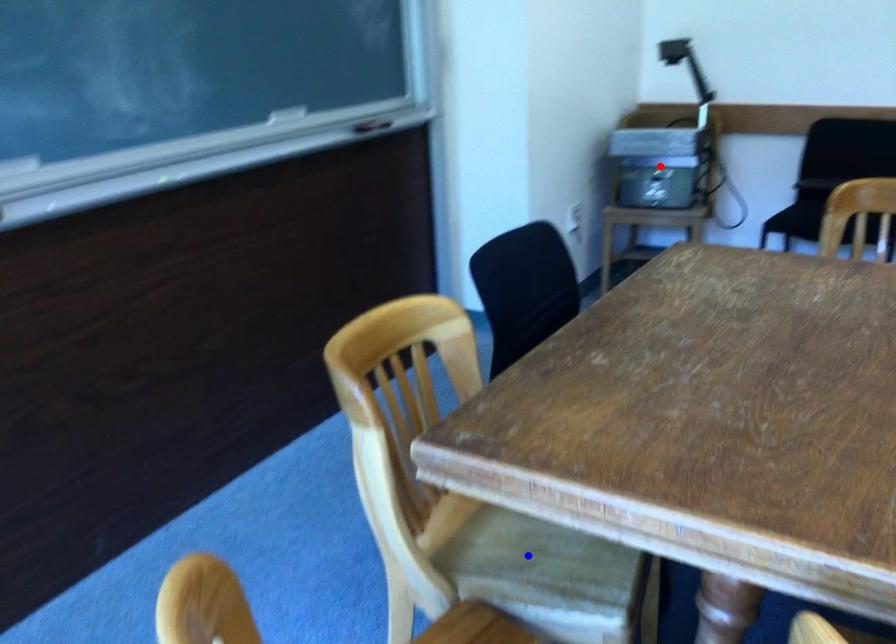
Question: Two points are marked on the image. Which point is closer to the camera?

Choices:
 (A) Blue point is closer.
 (B) Red point is closer.

Answer: (A)